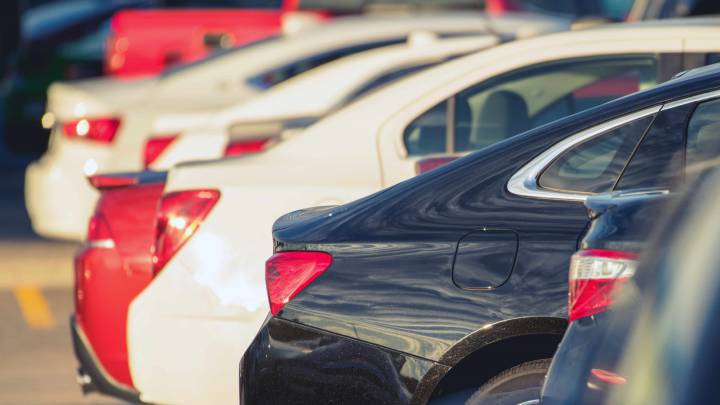
Locate an element on the screen. windows is located at coordinates (580, 174), (703, 125), (490, 104), (428, 132), (402, 68), (301, 58).